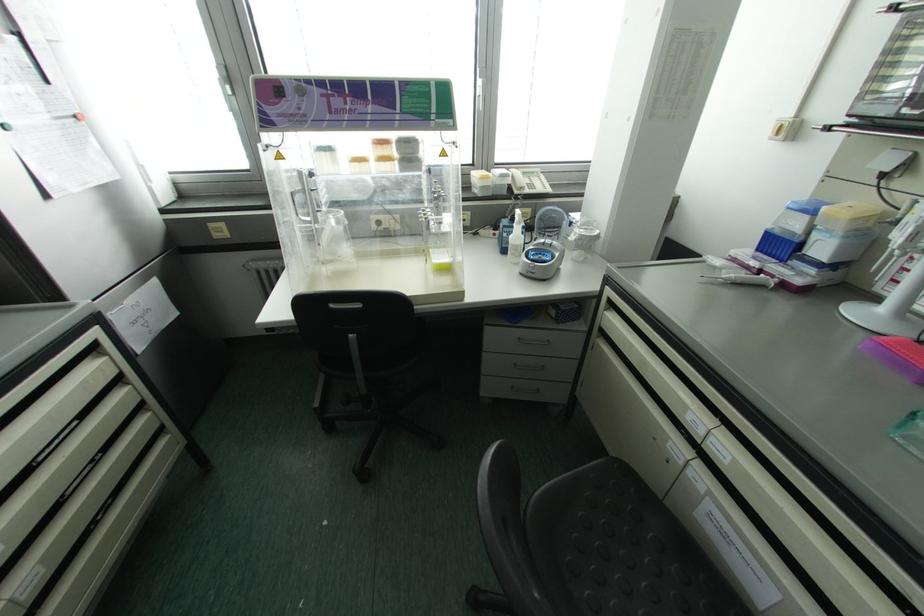
I want to click on white container lid, so click(882, 320).